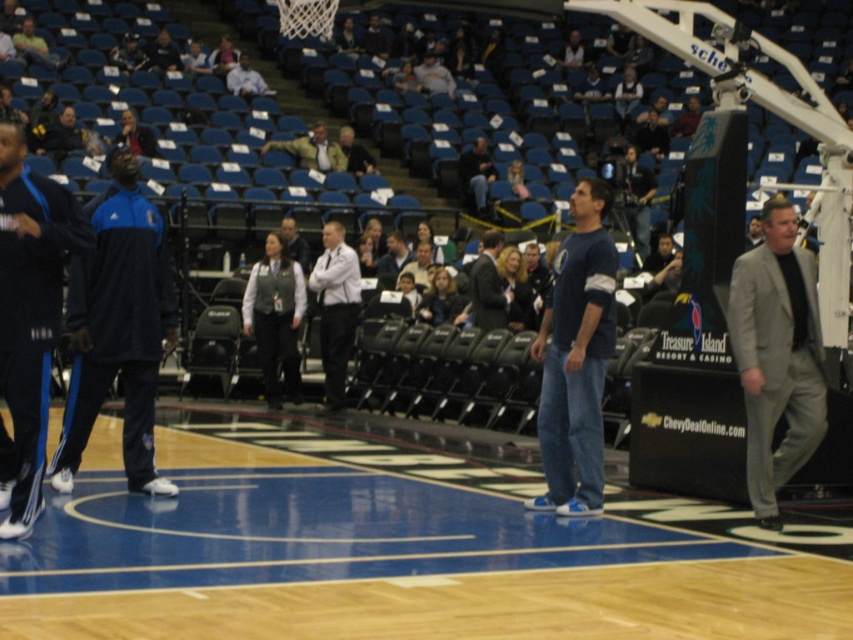
Question: Does white shirt at center appear on the right side of dark blue jeans at center?

Choices:
 (A) no
 (B) yes

Answer: (A)

Question: Which point appears farthest from the camera in this image?

Choices:
 (A) (457, 173)
 (B) (346, 132)
 (C) (171, 490)

Answer: (A)

Question: Is blue synthetic track suit at left bigger than black synthetic track pants at left?

Choices:
 (A) yes
 (B) no

Answer: (B)

Question: Does blue synthetic track suit at left have a larger size compared to dark gray suit at center?

Choices:
 (A) no
 (B) yes

Answer: (B)

Question: Estimate the real-world distances between objects in this image. Which object is farther from the white shirt at center?

Choices:
 (A) wooden basketball court at center
 (B) blue cotton shirt at center
 (C) dark gray suit at center
 (D) dark blue jeans at center

Answer: (A)

Question: Which point is farther to the camera?

Choices:
 (A) gray suit jacket at center
 (B) dark gray suit at center
 (C) gray suit at right

Answer: (A)